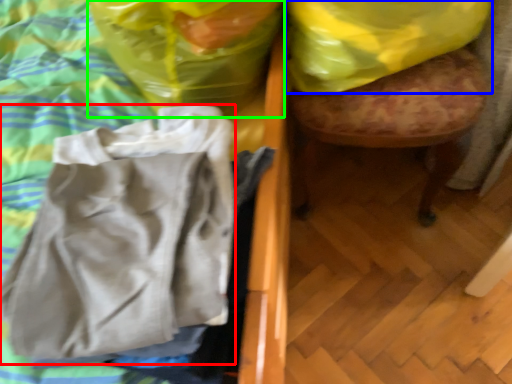
Question: Which is nearer to the wrap (highlighted by a red box)? plastic bag (highlighted by a blue box) or plastic bag (highlighted by a green box).

Choices:
 (A) plastic bag
 (B) plastic bag

Answer: (B)